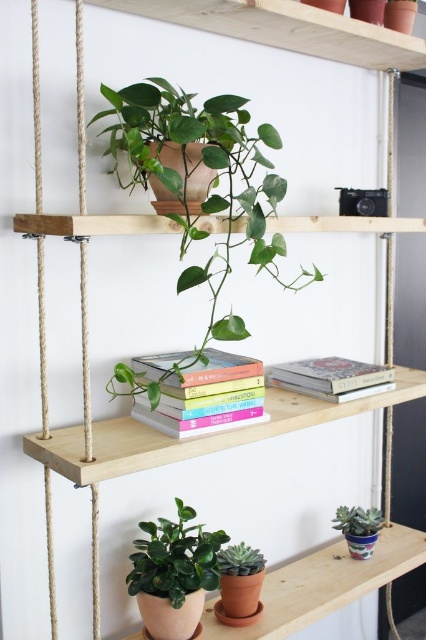
Between green matte plant at lower center and green matte succulent at lower center, which one is positioned lower?

Positioned lower is green matte succulent at lower center.

Find the location of a particular element. green matte plant at lower center is located at coordinates (175, 557).

Between hardcover book at center and green matte succulent at lower center, which one is positioned higher?

hardcover book at center is above.

Who is positioned more to the left, hardcover book at center or green matte succulent at lower center?

From the viewer's perspective, green matte succulent at lower center appears more on the left side.

Identify the location of hardcover book at center. (331, 378).

You are a GUI agent. You are given a task and a screenshot of the screen. Output one action in this format:
    pyautogui.click(x=<x>, y=<y>)
    Task: Click on the hardcover book at center
    The image size is (426, 640).
    Given the screenshot: What is the action you would take?
    pyautogui.click(x=331, y=378)

Can you confirm if green matte succulent at lower center is thinner than green matte succulent at lower right?

Correct, green matte succulent at lower center's width is less than green matte succulent at lower right's.

Does green matte succulent at lower center appear on the right side of green matte succulent at lower right?

In fact, green matte succulent at lower center is to the left of green matte succulent at lower right.

Does point (221, 570) come in front of point (345, 522)?

Yes, point (221, 570) is in front of point (345, 522).

I want to click on green matte succulent at lower center, so click(239, 561).